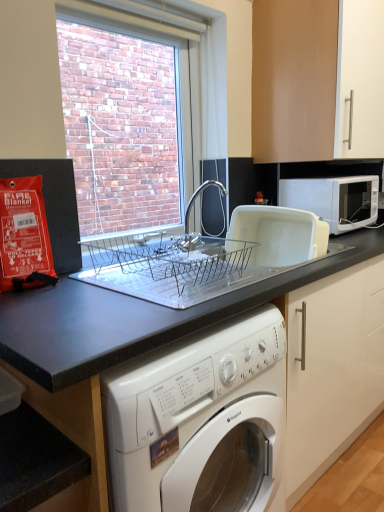
Find the location of a particular element. The height and width of the screenshot is (512, 384). empty space that is ontop of black granite countertop at center (from a real-world perspective) is located at coordinates (114, 304).